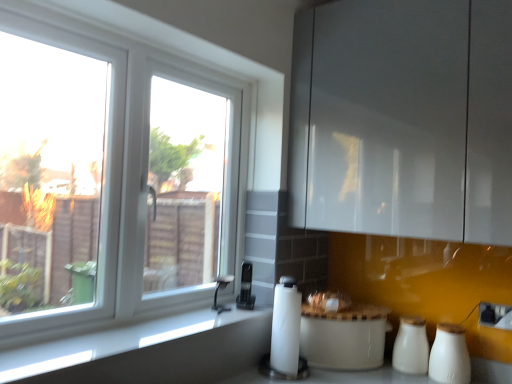
At what (x,y) coordinates should I click in order to perform the action: click on white glossy rice cooker at center, marked as the 1th appliance in a right-to-left arrangement. Please return your answer as a coordinate pair (x, y). The height and width of the screenshot is (384, 512). Looking at the image, I should click on (344, 337).

What do you see at coordinates (344, 337) in the screenshot? I see `white glossy rice cooker at center, arranged as the 2th appliance when viewed from the top` at bounding box center [344, 337].

Measure the distance between white matte paper towel at lower center and camera.

A distance of 5.07 feet exists between white matte paper towel at lower center and camera.

Identify the location of white matte salt shaker at lower right, which appears as the second salt shaker when viewed from the front. (411, 346).

What do you see at coordinates (218, 290) in the screenshot?
I see `satin nickel faucet at lower center` at bounding box center [218, 290].

This screenshot has width=512, height=384. Describe the element at coordinates (246, 288) in the screenshot. I see `black plastic phone at center, the first appliance viewed from the left` at that location.

How much space does white ceramic salt shaker at lower right, positioned as the 2th salt shaker in back-to-front order, occupy horizontally?

white ceramic salt shaker at lower right, positioned as the 2th salt shaker in back-to-front order, is 4.68 inches in width.

Measure the distance between point (263, 155) and camera.

Point (263, 155) is 6.05 feet from camera.

Identify the location of white glossy rice cooker at center, marked as the 1th appliance in a right-to-left arrangement. (344, 337).

In the scene shown: Does white glossy rice cooker at center, the 1th appliance positioned from the bottom, have a larger size compared to white ceramic salt shaker at lower right, positioned as the 2th salt shaker in back-to-front order?

Indeed, white glossy rice cooker at center, the 1th appliance positioned from the bottom, has a larger size compared to white ceramic salt shaker at lower right, positioned as the 2th salt shaker in back-to-front order.

Is white glossy rice cooker at center, arranged as the 2th appliance when viewed from the top, taller than white ceramic salt shaker at lower right, positioned as the 2th salt shaker in back-to-front order?

Indeed, white glossy rice cooker at center, arranged as the 2th appliance when viewed from the top, has a greater height compared to white ceramic salt shaker at lower right, positioned as the 2th salt shaker in back-to-front order.

From a real-world perspective, which object rests below the other?

In real-world perspective, white glossy rice cooker at center, arranged as the 2th appliance when viewed from the top, is lower.

Relative to white ceramic salt shaker at lower right, arranged as the first salt shaker when viewed from the front, is white glossy rice cooker at center, arranged as the 2th appliance when viewed from the top, in front or behind?

Clearly, white glossy rice cooker at center, arranged as the 2th appliance when viewed from the top, is behind white ceramic salt shaker at lower right, arranged as the first salt shaker when viewed from the front.

From a real-world perspective, which is physically above, white matte paper towel at lower center or satin nickel faucet at lower center?

In real-world perspective, satin nickel faucet at lower center is above.

The width and height of the screenshot is (512, 384). Find the location of `faucet above the white matte paper towel at lower center (from the image's perspective)`. faucet above the white matte paper towel at lower center (from the image's perspective) is located at coordinates (218, 290).

From the image's perspective, which object appears higher, white matte paper towel at lower center or satin nickel faucet at lower center?

satin nickel faucet at lower center, from the image's perspective.

Is white matte paper towel at lower center not near satin nickel faucet at lower center?

No, white matte paper towel at lower center is not far away from satin nickel faucet at lower center.

Is black plastic phone at center, the first appliance viewed from the left, at the back of satin nickel faucet at lower center?

No, black plastic phone at center, the first appliance viewed from the left, is not at the back of satin nickel faucet at lower center.

At what (x,y) coordinates should I click in order to perform the action: click on appliance above the satin nickel faucet at lower center (from a real-world perspective). Please return your answer as a coordinate pair (x, y). Looking at the image, I should click on (246, 288).

What's the angular difference between satin nickel faucet at lower center and black plastic phone at center, positioned as the first appliance in top-to-bottom order,'s facing directions?

The angular difference between satin nickel faucet at lower center and black plastic phone at center, positioned as the first appliance in top-to-bottom order, is 2.85 degrees.

Which of these two, satin nickel faucet at lower center or black plastic phone at center, the first appliance viewed from the left, is smaller?

Smaller between the two is satin nickel faucet at lower center.

Is white glossy rice cooker at center, the 1th appliance positioned from the bottom, behind white matte paper towel at lower center?

Yes.

Is point (300, 340) closer to camera compared to point (291, 306)?

That is False.

Is white glossy rice cooker at center, arranged as the 2th appliance when viewed from the top, at the left side of white matte paper towel at lower center?

No.

Looking at this image, from a real-world perspective, between white ceramic salt shaker at lower right, positioned as the 2th salt shaker in back-to-front order, and white glossy rice cooker at center, marked as the 1th appliance in a right-to-left arrangement, who is vertically higher?

white ceramic salt shaker at lower right, positioned as the 2th salt shaker in back-to-front order, is physically above.

From the image's perspective, is white ceramic salt shaker at lower right, positioned as the 2th salt shaker in back-to-front order, below white glossy rice cooker at center, marked as the second appliance in a left-to-right arrangement?

Incorrect, from the image's perspective, white ceramic salt shaker at lower right, positioned as the 2th salt shaker in back-to-front order, is higher than white glossy rice cooker at center, marked as the second appliance in a left-to-right arrangement.

Find the location of `appliance that is below the white ceramic salt shaker at lower right, positioned as the 2th salt shaker in back-to-front order (from the image's perspective)`. appliance that is below the white ceramic salt shaker at lower right, positioned as the 2th salt shaker in back-to-front order (from the image's perspective) is located at coordinates [x=344, y=337].

In terms of width, does white ceramic salt shaker at lower right, arranged as the first salt shaker when viewed from the front, look wider or thinner when compared to white glossy rice cooker at center, marked as the second appliance in a left-to-right arrangement?

Considering their sizes, white ceramic salt shaker at lower right, arranged as the first salt shaker when viewed from the front, looks slimmer than white glossy rice cooker at center, marked as the second appliance in a left-to-right arrangement.

Considering the relative sizes of smooth gray countertop at lower left and white plastic window at left in the image provided, is smooth gray countertop at lower left bigger than white plastic window at left?

Actually, smooth gray countertop at lower left might be smaller than white plastic window at left.

Can you confirm if smooth gray countertop at lower left is thinner than white plastic window at left?

Incorrect, the width of smooth gray countertop at lower left is not less than that of white plastic window at left.

Is smooth gray countertop at lower left with white plastic window at left?

No, smooth gray countertop at lower left is not with white plastic window at left.

Does point (292, 288) come behind point (245, 301)?

No, it is not.

From the image's perspective, is white matte paper towel at lower center below black plastic phone at center, the second appliance from the right?

Indeed, from the image's perspective, white matte paper towel at lower center is shown beneath black plastic phone at center, the second appliance from the right.

Is the depth of white matte paper towel at lower center greater than that of black plastic phone at center, the second appliance from the right?

That is False.

From the picture: How many degrees apart are the facing directions of white matte paper towel at lower center and black plastic phone at center, positioned as the first appliance in top-to-bottom order?

The angular difference between white matte paper towel at lower center and black plastic phone at center, positioned as the first appliance in top-to-bottom order, is 0.981 degrees.

This screenshot has width=512, height=384. I want to click on appliance below the white ceramic salt shaker at lower right, positioned as the 2th salt shaker in back-to-front order (from a real-world perspective), so click(344, 337).

In the image, there is a satin nickel faucet at lower center. Identify the location of paper towel below it (from the image's perspective). (286, 327).

Considering their positions, is satin nickel faucet at lower center positioned further to white plastic window at left than white matte paper towel at lower center?

satin nickel faucet at lower center.

From the image, which object appears to be nearer to black plastic phone at center, the second appliance positioned from the bottom, satin nickel faucet at lower center or smooth gray countertop at lower left?

satin nickel faucet at lower center lies closer to black plastic phone at center, the second appliance positioned from the bottom, than the other object.

Looking at the image, which one is located closer to white plastic window at left, smooth gray countertop at lower left or white matte salt shaker at lower right, which is counted as the 1th salt shaker, starting from the back?

smooth gray countertop at lower left.

When comparing their distances from white matte salt shaker at lower right, which appears as the second salt shaker when viewed from the front, does black plastic phone at center, the second appliance positioned from the bottom, or white ceramic salt shaker at lower right, arranged as the first salt shaker when viewed from the front, seem closer?

white ceramic salt shaker at lower right, arranged as the first salt shaker when viewed from the front, is closer to white matte salt shaker at lower right, which appears as the second salt shaker when viewed from the front.

Which object lies nearer to the anchor point white plastic window at left, white matte salt shaker at lower right, which appears as the second salt shaker when viewed from the front, or satin nickel faucet at lower center?

satin nickel faucet at lower center is positioned closer to the anchor white plastic window at left.

Estimate the real-world distances between objects in this image. Which object is further from black plastic phone at center, positioned as the first appliance in top-to-bottom order, smooth gray countertop at lower left or satin nickel faucet at lower center?

Among the two, smooth gray countertop at lower left is located further to black plastic phone at center, positioned as the first appliance in top-to-bottom order.

Looking at the image, which one is located further to smooth gray countertop at lower left, white glossy rice cooker at center, marked as the second appliance in a left-to-right arrangement, or white matte salt shaker at lower right, which is counted as the 1th salt shaker, starting from the back?

Based on the image, white matte salt shaker at lower right, which is counted as the 1th salt shaker, starting from the back, appears to be further to smooth gray countertop at lower left.

Considering their positions, is white ceramic salt shaker at lower right, positioned as the 2th salt shaker in back-to-front order, positioned further to smooth gray countertop at lower left than black plastic phone at center, positioned as the first appliance in top-to-bottom order?

white ceramic salt shaker at lower right, positioned as the 2th salt shaker in back-to-front order, is further to smooth gray countertop at lower left.

This screenshot has width=512, height=384. What are the coordinates of `counter top between white plastic window at left and white ceramic salt shaker at lower right, positioned as the 2th salt shaker in back-to-front order, from left to right` in the screenshot? It's located at (149, 351).

Where is `paper towel between white plastic window at left and white matte salt shaker at lower right, which is counted as the 1th salt shaker, starting from the back, from left to right`? paper towel between white plastic window at left and white matte salt shaker at lower right, which is counted as the 1th salt shaker, starting from the back, from left to right is located at coordinates (286, 327).

What are the coordinates of `paper towel between satin nickel faucet at lower center and white ceramic salt shaker at lower right, positioned as the 2th salt shaker in back-to-front order, in the horizontal direction` in the screenshot? It's located at (286, 327).

This screenshot has width=512, height=384. In order to click on paper towel between white plastic window at left and satin nickel faucet at lower center in the front-back direction in this screenshot , I will do `click(286, 327)`.